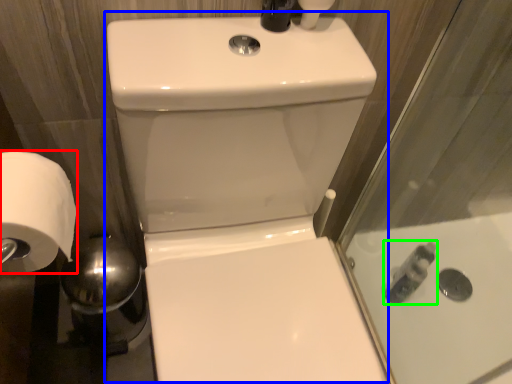
Question: Based on their relative distances, which object is farther from toilet paper (highlighted by a red box)? Choose from sink (highlighted by a blue box) and toiletry (highlighted by a green box).

Choices:
 (A) sink
 (B) toiletry

Answer: (B)